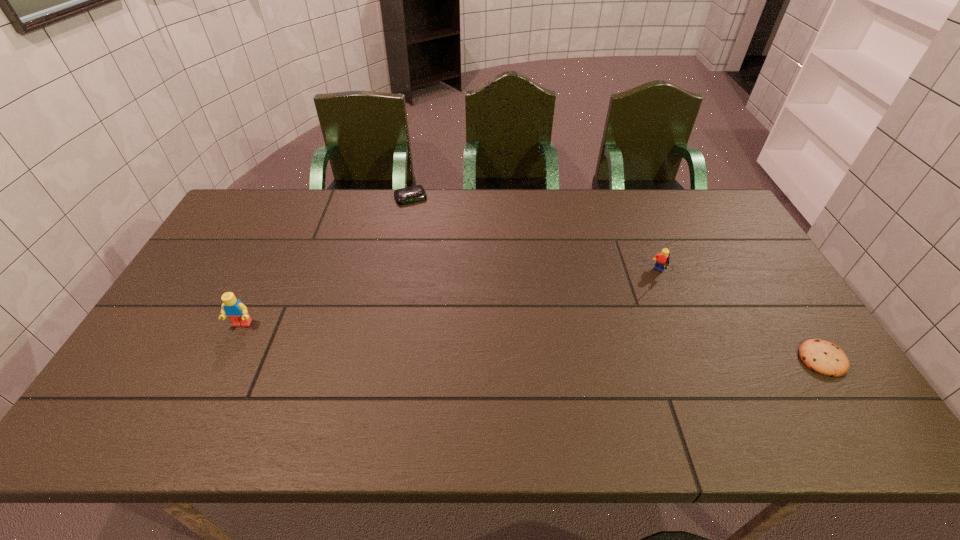
Image resolution: width=960 pixels, height=540 pixels. What are the coordinates of `the second nearest object` in the screenshot? It's located at (237, 312).

This screenshot has height=540, width=960. In order to click on the nearer Lego in this screenshot , I will do `click(237, 312)`.

Image resolution: width=960 pixels, height=540 pixels. What are the coordinates of `the rightmost object` in the screenshot? It's located at (825, 358).

Identify the location of cookie. The image size is (960, 540). (825, 358).

Locate an element on the screen. This screenshot has height=540, width=960. the farthest object is located at coordinates (416, 193).

I want to click on the second object from left to right, so click(x=416, y=193).

The height and width of the screenshot is (540, 960). In order to click on the second farthest object in this screenshot , I will do `click(662, 260)`.

Where is `the farther Lego`? the farther Lego is located at coordinates click(x=662, y=260).

You are a GUI agent. You are given a task and a screenshot of the screen. Output one action in this format:
    pyautogui.click(x=<x>, y=<y>)
    Task: Click on the free location located 0.080m on the front-facing side of the leftmost object
    The image size is (960, 540).
    Given the screenshot: What is the action you would take?
    pyautogui.click(x=227, y=355)

Identify the location of blank space located on the back of the nearest object. (784, 302).